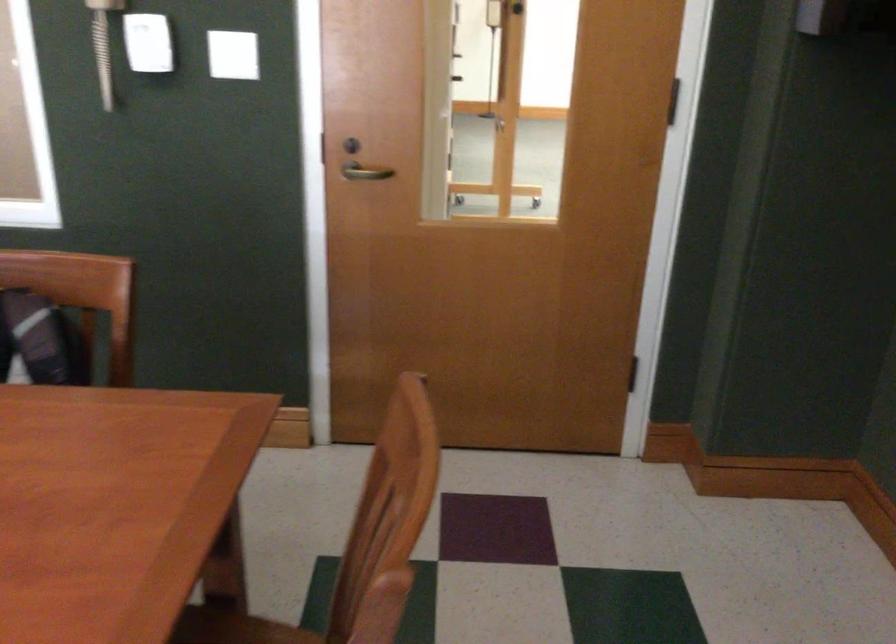
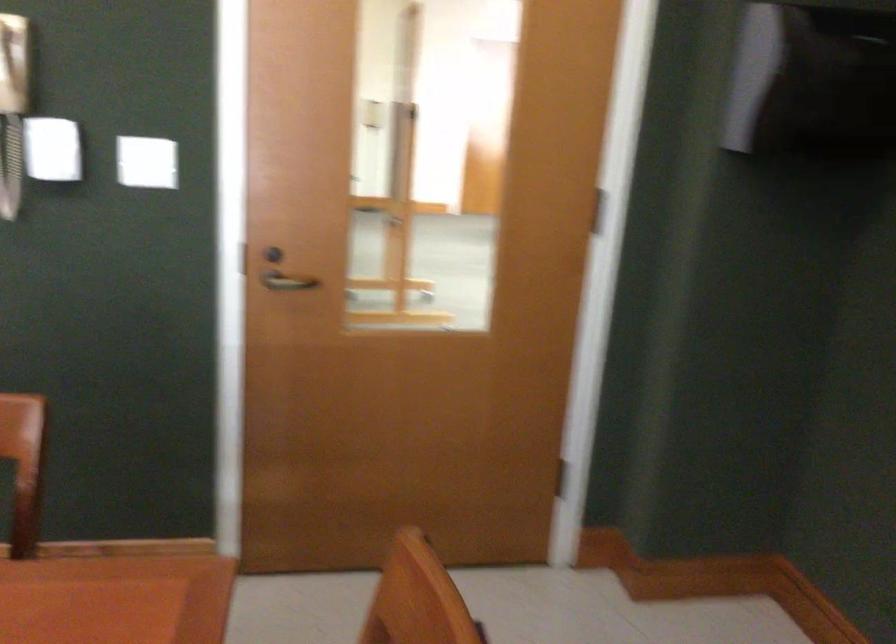
The images are taken continuously from a first-person perspective. In which direction are you moving?

The cameraman moved toward left, forward.